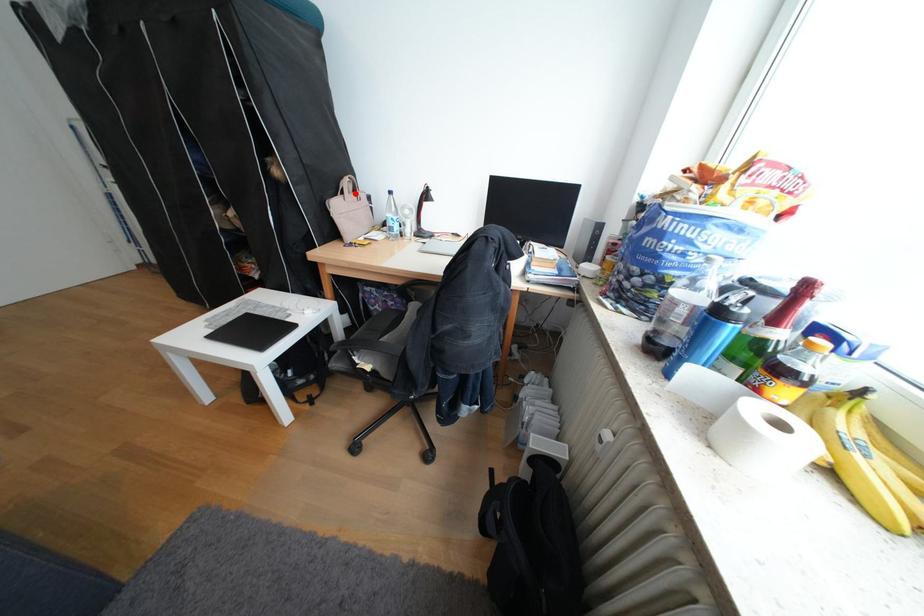
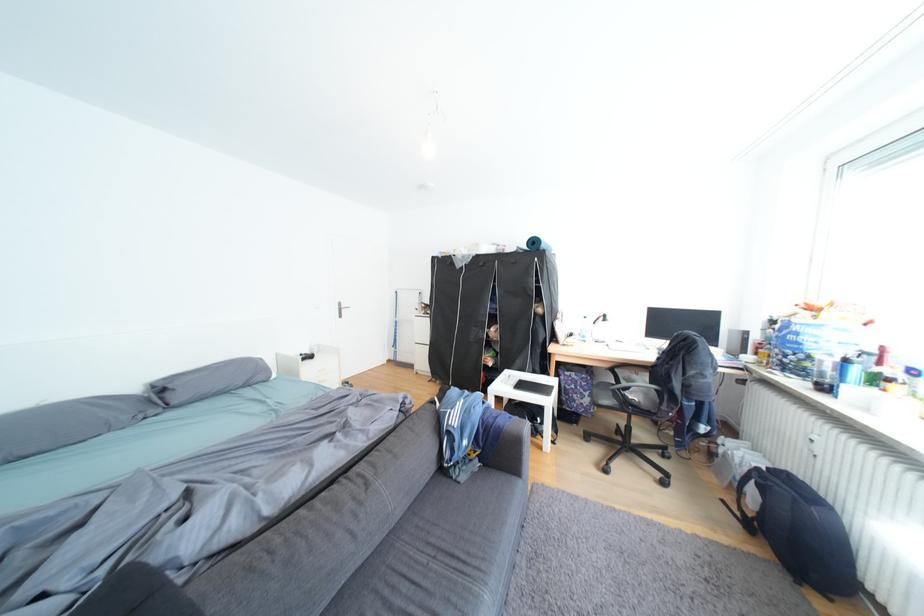
Question: I am providing you with two images of the same scene from different viewpoints. Given a red point in image1, look at the same physical point in image2. Is it:

Choices:
 (A) Closer to the viewpoint
 (B) Farther from the viewpoint

Answer: (B)